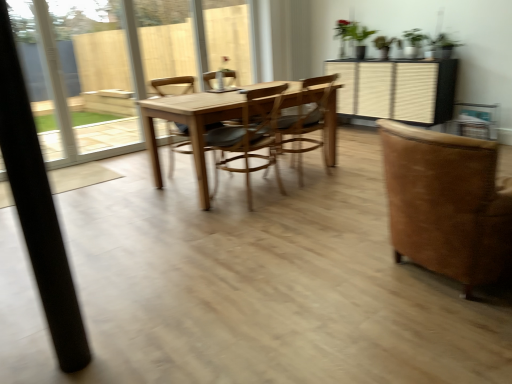
Find the location of a particular element. free area in between wooden chair at center, positioned as the first chair in left-to-right order, and black matte pole at left is located at coordinates (155, 233).